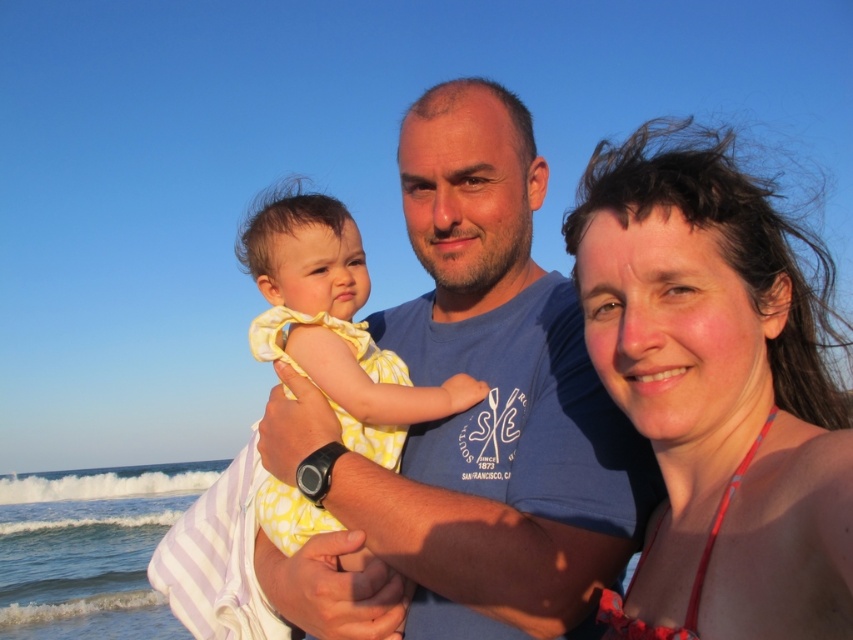
Is point (660, 584) behind point (300, 276)?

No, it is not.

Is point (773, 566) positioned in front of point (302, 525)?

Yes, point (773, 566) is closer to viewer.

Does point (819, 472) come farther from viewer compared to point (334, 408)?

No.

At what (x,y) coordinates should I click in order to perform the action: click on matte pink bikini top at center. Please return your answer as a coordinate pair (x, y). The height and width of the screenshot is (640, 853). Looking at the image, I should click on (717, 392).

Is point (515, 625) farther from camera compared to point (337, 310)?

No.

Who is shorter, blue cotton shirt at center or yellow dotted dress at center?

yellow dotted dress at center

Between point (483, 163) and point (343, 355), which one is positioned in front?

Point (343, 355) is in front.

This screenshot has height=640, width=853. In order to click on blue cotton shirt at center in this screenshot , I will do `click(480, 417)`.

Is blue cotton shirt at center thinner than matte pink bikini top at center?

No, blue cotton shirt at center is not thinner than matte pink bikini top at center.

This screenshot has width=853, height=640. I want to click on blue cotton shirt at center, so coord(480,417).